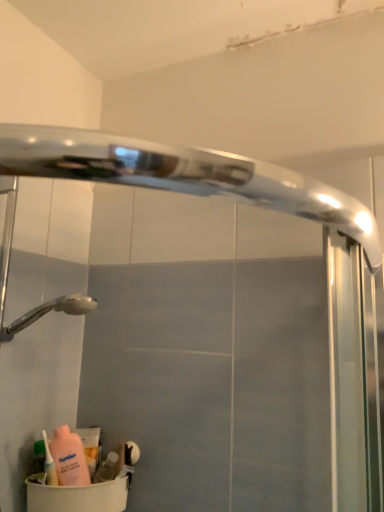
Question: Considering the positions of point (69, 499) and point (84, 450), is point (69, 499) closer or farther from the camera than point (84, 450)?

Choices:
 (A) farther
 (B) closer

Answer: (B)

Question: From their relative heights in the image, would you say beige plastic container at lower left is taller or shorter than matte pink lotion at lower left, acting as the 2th cleaning product starting from the front?

Choices:
 (A) short
 (B) tall

Answer: (A)

Question: Based on their relative distances, which object is nearer to the beige plastic container at lower left?

Choices:
 (A) pink matte bottle at lower left, arranged as the first cleaning product when viewed from the front
 (B) translucent plastic soap at lower left, acting as the 2th toiletry starting from the left
 (C) green matte bottle at lower left, the first toiletry in the left-to-right sequence
 (D) matte pink lotion at lower left, the 1th cleaning product viewed from the right

Answer: (B)

Question: Estimate the real-world distances between objects in this image. Which object is closer to the green matte bottle at lower left, which appears as the second toiletry when viewed from the right?

Choices:
 (A) pink matte bottle at lower left, which is counted as the first cleaning product, starting from the left
 (B) beige plastic container at lower left
 (C) matte pink lotion at lower left, which is the second cleaning product in left-to-right order
 (D) translucent plastic soap at lower left, placed as the 1th toiletry when sorted from right to left

Answer: (A)